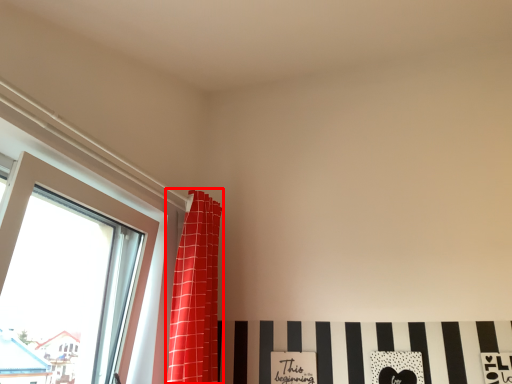
Question: From the image's perspective, where is curtain (annotated by the red box) located in relation to window in the image?

Choices:
 (A) above
 (B) below

Answer: (B)